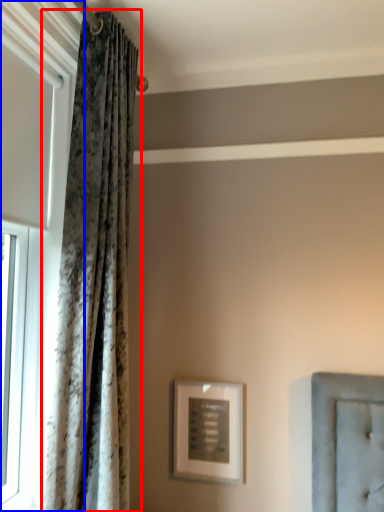
Question: Which object is closer to the camera taking this photo, curtain (highlighted by a red box) or window (highlighted by a blue box)?

Choices:
 (A) curtain
 (B) window

Answer: (B)